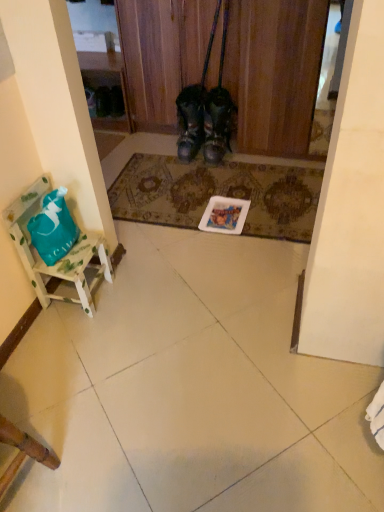
In order to click on unoccupied region to the right of wooden chair at lower left in this screenshot , I will do `click(81, 467)`.